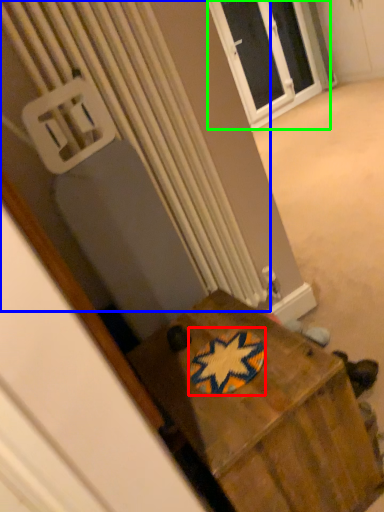
Question: Based on their relative distances, which object is farther from design (highlighted by a red box)? Choose from radiator (highlighted by a blue box) and window (highlighted by a green box).

Choices:
 (A) radiator
 (B) window

Answer: (B)